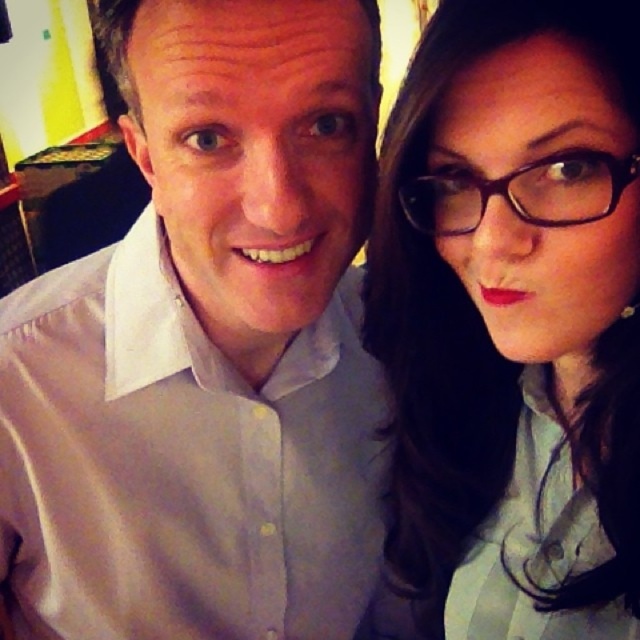
Based on the photo, you are a photographer adjusting the lighting for a portrait. You notice two pairs of glasses in the frame. The matte black glasses at upper right and the black plastic glasses at upper right. Which pair of glasses is wider?

The matte black glasses at upper right is wider than the black plastic glasses at upper right according to the description.

You are a photographer trying to adjust the lighting for a portrait. You notice two pairs of glasses in the image, the matte black glasses at upper right and the black plastic glasses at upper right. Which pair is positioned more to the right?

The matte black glasses at upper right is positioned on the right side of black plastic glasses at upper right, so it is more to the right.

You are taking a photo of two people standing at point (381, 356) and point (627, 177). Which point is closer to the camera?

Point (627, 177) is closer to the camera because point (381, 356) is behind it.